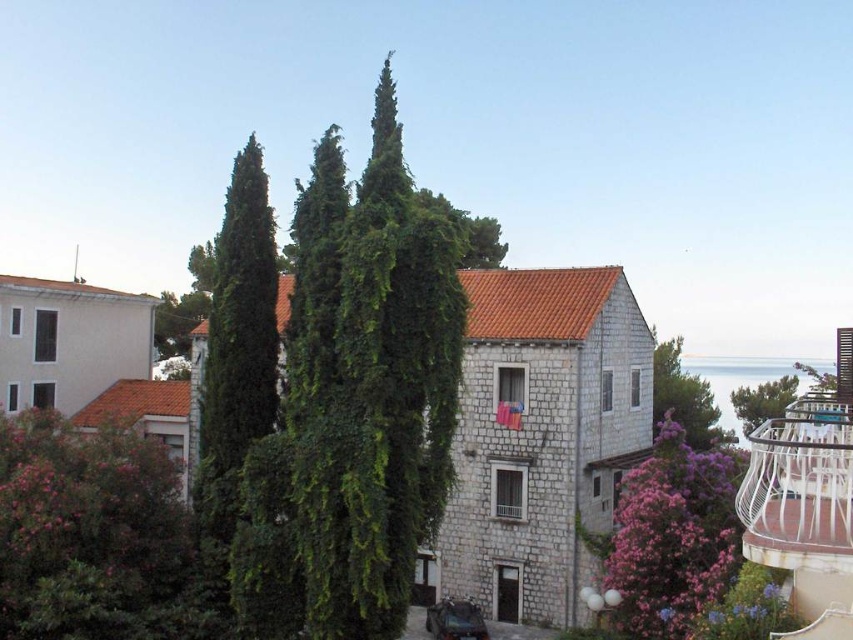
Which of these two, green leafy cypress at center or green leafy tree at center, stands shorter?

green leafy tree at center is shorter.

Who is taller, green leafy cypress at center or green leafy tree at center?

green leafy cypress at center

Where is `green leafy cypress at center`? green leafy cypress at center is located at coordinates (355, 406).

Where is `green leafy cypress at center`? The height and width of the screenshot is (640, 853). green leafy cypress at center is located at coordinates (355, 406).

Between point (440, 476) and point (798, 536), which one is positioned in front?

Point (798, 536) is in front.

The image size is (853, 640). What are the coordinates of `green leafy cypress at center` in the screenshot? It's located at (355, 406).

This screenshot has height=640, width=853. What do you see at coordinates (683, 397) in the screenshot? I see `green leafy tree at center` at bounding box center [683, 397].

Between point (666, 378) and point (786, 381), which one is positioned behind?

The point (786, 381) is more distant.

Find the location of `green leafy tree at center`. green leafy tree at center is located at coordinates (683, 397).